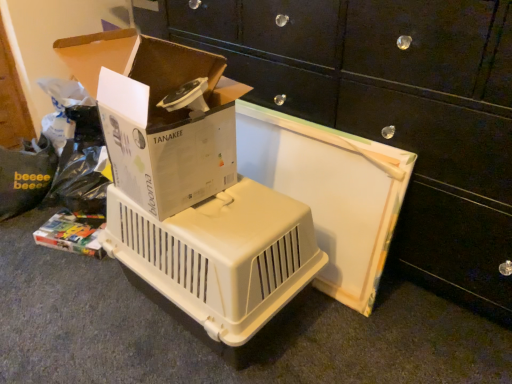
Question: Is white cardboard box at upper left at the right side of beige plastic pet carrier at center?

Choices:
 (A) no
 (B) yes

Answer: (A)

Question: Does white cardboard box at upper left have a smaller size compared to beige plastic pet carrier at center?

Choices:
 (A) no
 (B) yes

Answer: (B)

Question: Does white cardboard box at upper left have a greater width compared to beige plastic pet carrier at center?

Choices:
 (A) no
 (B) yes

Answer: (A)

Question: Is white cardboard box at upper left surrounding beige plastic pet carrier at center?

Choices:
 (A) yes
 (B) no

Answer: (B)

Question: From a real-world perspective, is white cardboard box at upper left on beige plastic pet carrier at center?

Choices:
 (A) yes
 (B) no

Answer: (A)

Question: Based on their sizes in the image, would you say white plastic pet carrier at center is bigger or smaller than beige plastic pet carrier at center?

Choices:
 (A) small
 (B) big

Answer: (B)

Question: Is white plastic pet carrier at center wider or thinner than beige plastic pet carrier at center?

Choices:
 (A) wide
 (B) thin

Answer: (A)

Question: Considering the relative positions of white plastic pet carrier at center and beige plastic pet carrier at center in the image provided, is white plastic pet carrier at center to the left or to the right of beige plastic pet carrier at center?

Choices:
 (A) left
 (B) right

Answer: (B)

Question: From their relative heights in the image, would you say white plastic pet carrier at center is taller or shorter than beige plastic pet carrier at center?

Choices:
 (A) tall
 (B) short

Answer: (A)

Question: Is white plastic pet carrier at center wider or thinner than white cardboard box at upper left?

Choices:
 (A) wide
 (B) thin

Answer: (A)

Question: Do you think white plastic pet carrier at center is within white cardboard box at upper left, or outside of it?

Choices:
 (A) outside
 (B) inside

Answer: (A)

Question: From their relative heights in the image, would you say white plastic pet carrier at center is taller or shorter than white cardboard box at upper left?

Choices:
 (A) tall
 (B) short

Answer: (A)

Question: In the image, is white plastic pet carrier at center on the left side or the right side of white cardboard box at upper left?

Choices:
 (A) right
 (B) left

Answer: (A)

Question: From a real-world perspective, is white cardboard box at upper left positioned above or below beige plastic pet carrier at center?

Choices:
 (A) above
 (B) below

Answer: (A)

Question: From the image's perspective, is white cardboard box at upper left located above or below beige plastic pet carrier at center?

Choices:
 (A) below
 (B) above

Answer: (B)